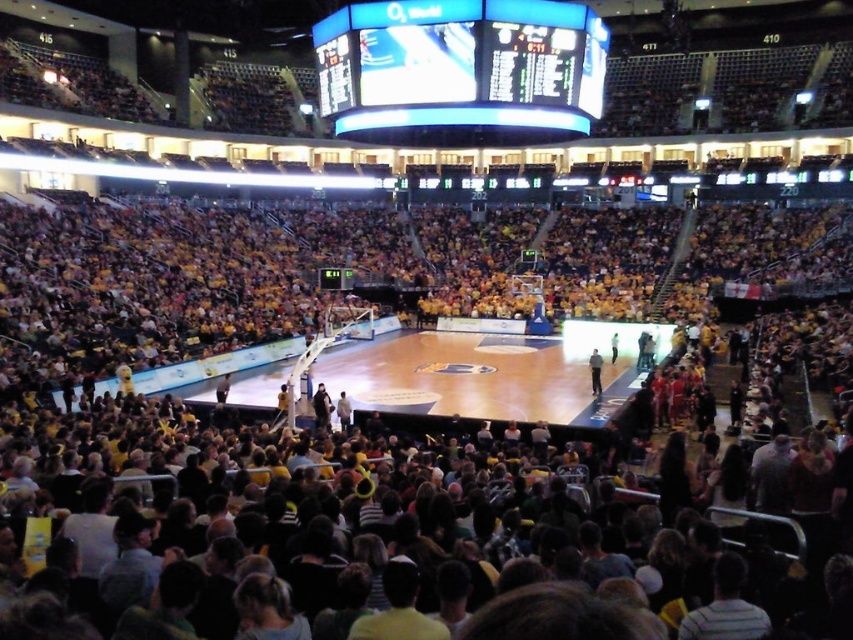
Question: Is wooden polished basketball court at center positioned in front of light blue jersey at center?

Choices:
 (A) yes
 (B) no

Answer: (A)

Question: Is wooden polished basketball court at center to the left of light blue jersey at center from the viewer's perspective?

Choices:
 (A) yes
 (B) no

Answer: (A)

Question: Which object is closer to the camera taking this photo?

Choices:
 (A) wooden polished basketball court at center
 (B) blue led scoreboard at center

Answer: (A)

Question: Which object is the closest to the light blue jersey at center?

Choices:
 (A) wooden polished basketball court at center
 (B) blue led scoreboard at center

Answer: (A)

Question: Does blue led scoreboard at center appear on the right side of light blue jersey at center?

Choices:
 (A) yes
 (B) no

Answer: (B)

Question: Based on their relative distances, which object is farther from the wooden polished basketball court at center?

Choices:
 (A) blue led scoreboard at center
 (B) light blue jersey at center

Answer: (A)